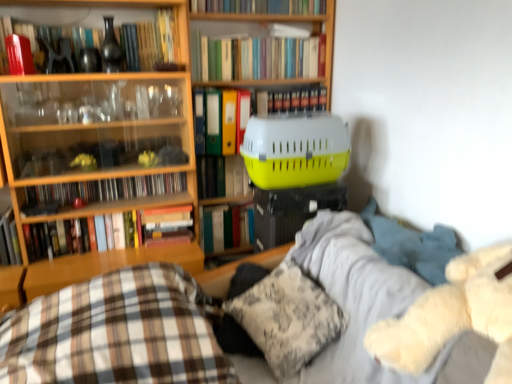
Measure the distance between fluffy white pillow at center, which is the 1th pillow from right to left, and camera.

fluffy white pillow at center, which is the 1th pillow from right to left, is 1.52 meters from camera.

What is the approximate width of fluffy white pillow at center, which is the 1th pillow from right to left?

fluffy white pillow at center, which is the 1th pillow from right to left, is 16.42 inches in width.

What is the approximate width of hardcover book at center, positioned as the tenth book in top-to-bottom order?

It is 5.63 inches.

I want to click on hardcover book at center, which is the second book from bottom to top, so (106, 233).

What do you see at coordinates (100, 191) in the screenshot? The width and height of the screenshot is (512, 384). I see `matte black book at left, placed as the eighth book when sorted from top to bottom` at bounding box center [100, 191].

Where is `matte black book at left, marked as the 4th book in a bottom-to-top arrangement`? Image resolution: width=512 pixels, height=384 pixels. matte black book at left, marked as the 4th book in a bottom-to-top arrangement is located at coordinates (100, 191).

Describe the element at coordinates (96, 151) in the screenshot. I see `wooden bookshelf at left` at that location.

Find the location of `fluffy white pillow at center, which is counted as the 2th pillow, starting from the left`. fluffy white pillow at center, which is counted as the 2th pillow, starting from the left is located at coordinates (278, 317).

Where is `book that is the 7th one when counting forward from the hardcover books at upper center, placed as the ninth book when sorted from bottom to top`? The width and height of the screenshot is (512, 384). book that is the 7th one when counting forward from the hardcover books at upper center, placed as the ninth book when sorted from bottom to top is located at coordinates pos(150,41).

Is hardcover books at upper center, placed as the ninth book when sorted from bottom to top, facing towards matte black vase at upper left, the fourth book positioned from the top?

No.

Is hardcover books at upper center, placed as the third book when sorted from top to bottom, next to matte black vase at upper left, which is counted as the eighth book, starting from the bottom, and touching it?

No, hardcover books at upper center, placed as the third book when sorted from top to bottom, is not touching matte black vase at upper left, which is counted as the eighth book, starting from the bottom.

From the image's perspective, which is below, hardcover books at upper center, placed as the third book when sorted from top to bottom, or matte black vase at upper left, the fourth book positioned from the top?

matte black vase at upper left, the fourth book positioned from the top, is shown below in the image.

Is hardcover book at center, which appears as the 5th book when ordered from the bottom, thinner than yellow matte file folder at center, which appears as the 6th book when ordered from the bottom?

Yes, hardcover book at center, which appears as the 5th book when ordered from the bottom, is thinner than yellow matte file folder at center, which appears as the 6th book when ordered from the bottom.

Is hardcover book at center, the seventh book positioned from the top, positioned before yellow matte file folder at center, which appears as the 6th book when ordered from the bottom?

No, it is not.

Based on their sizes in the image, would you say hardcover book at center, which appears as the 5th book when ordered from the bottom, is bigger or smaller than yellow matte file folder at center, which appears as the 6th book when ordered from the bottom?

In the image, hardcover book at center, which appears as the 5th book when ordered from the bottom, appears to be smaller than yellow matte file folder at center, which appears as the 6th book when ordered from the bottom.

From a real-world perspective, does hardcover book at center, which appears as the 5th book when ordered from the bottom, sit lower than yellow matte file folder at center, which appears as the 6th book when ordered from the bottom?

Yes, from a real-world perspective, hardcover book at center, which appears as the 5th book when ordered from the bottom, is below yellow matte file folder at center, which appears as the 6th book when ordered from the bottom.

Find the location of a particular element. the 5th book below the wooden bookcase at center (from the image's perspective) is located at coordinates (9, 240).

From the image's perspective, is wooden bookcase at center on top of hardcover book at left, which ranks as the 11th book in top-to-bottom order?

Yes.

Is wooden bookcase at center at the right side of hardcover book at left, which ranks as the 1th book in bottom-to-top order?

Indeed, wooden bookcase at center is positioned on the right side of hardcover book at left, which ranks as the 1th book in bottom-to-top order.

Is wooden bookshelf at left wider or thinner than yellow matte file folder at center, which appears as the 6th book when ordered from the bottom?

In the image, wooden bookshelf at left appears to be wider than yellow matte file folder at center, which appears as the 6th book when ordered from the bottom.

In the scene shown: From a real-world perspective, between wooden bookshelf at left and yellow matte file folder at center, the 6th book in the top-to-bottom sequence, who is vertically higher?

From a 3D spatial view, yellow matte file folder at center, the 6th book in the top-to-bottom sequence, is above.

Considering the relative sizes of wooden bookshelf at left and yellow matte file folder at center, which appears as the 6th book when ordered from the bottom, in the image provided, is wooden bookshelf at left bigger than yellow matte file folder at center, which appears as the 6th book when ordered from the bottom,?

Correct, wooden bookshelf at left is larger in size than yellow matte file folder at center, which appears as the 6th book when ordered from the bottom.

Consider the image. Is yellow plastic pet carrier at upper right surrounding wooden bookcase at center?

No, wooden bookcase at center is not a part of yellow plastic pet carrier at upper right.

Can you confirm if yellow plastic pet carrier at upper right is thinner than wooden bookcase at center?

No, yellow plastic pet carrier at upper right is not thinner than wooden bookcase at center.

Considering the positions of point (254, 169) and point (260, 168), is point (254, 169) closer or farther from the camera than point (260, 168)?

Point (254, 169) is positioned farther from the camera compared to point (260, 168).

Is yellow plastic pet carrier at upper right further to the viewer compared to wooden bookcase at center?

No, the depth of yellow plastic pet carrier at upper right is less than that of wooden bookcase at center.

Does wooden bookshelf at left have a greater width compared to hardcover book at center, the seventh book positioned from the top?

Yes, wooden bookshelf at left is wider than hardcover book at center, the seventh book positioned from the top.

Where is `the 5th book to the right when counting from the wooden bookshelf at left`? This screenshot has height=384, width=512. the 5th book to the right when counting from the wooden bookshelf at left is located at coordinates click(222, 177).

Which point is more distant from viewer, (x=45, y=209) or (x=239, y=161)?

The point (x=239, y=161) is farther from the camera.

Is hardcover book at center, which appears as the 5th book when ordered from the bottom, at the back of wooden bookshelf at left?

wooden bookshelf at left is not turned away from hardcover book at center, which appears as the 5th book when ordered from the bottom.

Based on the photo, from the image's perspective, is wooden bookcase at center located beneath white fluffy teddy bear at right?

No, from the image's perspective, wooden bookcase at center is not beneath white fluffy teddy bear at right.

Is wooden bookcase at center not inside white fluffy teddy bear at right?

wooden bookcase at center is positioned outside white fluffy teddy bear at right.

Does wooden bookcase at center lie behind white fluffy teddy bear at right?

That is True.

The height and width of the screenshot is (384, 512). Identify the location of teddy in front of the wooden bookcase at center. (452, 315).

Which book is the 8th one when counting from the left side of the hardcover books at upper center, placed as the third book when sorted from top to bottom? Please provide its 2D coordinates.

[(150, 41)]

I want to click on book that is the 1st one above the hardcover book at center, the seventh book positioned from the top (from a real-world perspective), so click(223, 119).

Looking at the image, which one is located closer to matte black vase at upper left, which is counted as the eighth book, starting from the bottom, matte black book at left, placed as the eighth book when sorted from top to bottom, or wooden bookshelf at left?

Based on the image, wooden bookshelf at left appears to be nearer to matte black vase at upper left, which is counted as the eighth book, starting from the bottom.

Consider the image. Which object lies further to the anchor point fluffy white pillow at lower center, which is counted as the 2th pillow, starting from the right, green matte book at center, positioned as the third book in bottom-to-top order, or fluffy white pillow at center, which is counted as the 2th pillow, starting from the left?

green matte book at center, positioned as the third book in bottom-to-top order, lies further to fluffy white pillow at lower center, which is counted as the 2th pillow, starting from the right, than the other object.

Which object lies nearer to the anchor point hardcover book at center, the seventh book positioned from the top, green matte book at center, positioned as the third book in bottom-to-top order, or hardcover book at center, which is the second book from bottom to top?

green matte book at center, positioned as the third book in bottom-to-top order, is closer to hardcover book at center, the seventh book positioned from the top.

Estimate the real-world distances between objects in this image. Which object is further from wooden bookshelf at left, hardcover book at upper center, the 10th book when ordered from bottom to top, or hardcover book at center, the seventh book positioned from the top?

hardcover book at upper center, the 10th book when ordered from bottom to top, is further to wooden bookshelf at left.

Based on their spatial positions, is hardcover book at center, which appears as the 5th book when ordered from the bottom, or yellow plastic pet carrier at upper right closer to hardcover book at upper center, the 11th book ordered from the bottom?

yellow plastic pet carrier at upper right is positioned closer to the anchor hardcover book at upper center, the 11th book ordered from the bottom.

Looking at the image, which one is located further to hardcover book at center, the seventh book positioned from the top, hardcover book at center, arranged as the seventh book when ordered from the bottom, or wooden bookshelf at left?

wooden bookshelf at left lies further to hardcover book at center, the seventh book positioned from the top, than the other object.

Considering their positions, is matte black book at left, placed as the eighth book when sorted from top to bottom, positioned further to yellow matte file folder at center, the 6th book in the top-to-bottom sequence, than hardcover books at upper center, placed as the ninth book when sorted from bottom to top?

matte black book at left, placed as the eighth book when sorted from top to bottom, is positioned further to the anchor yellow matte file folder at center, the 6th book in the top-to-bottom sequence.

From the image, which object appears to be farther from green matte book at center, positioned as the ninth book in top-to-bottom order, yellow plastic pet carrier at upper right or white fluffy teddy bear at right?

white fluffy teddy bear at right.

The height and width of the screenshot is (384, 512). What are the coordinates of `teddy between fluffy white pillow at lower center, which is counted as the 2th pillow, starting from the right, and matte black book at left, placed as the eighth book when sorted from top to bottom, from front to back` in the screenshot? It's located at (452, 315).

At what (x,y) coordinates should I click in order to perform the action: click on bookcase between hardcover book at upper center, the 11th book ordered from the bottom, and matte black book at left, marked as the 4th book in a bottom-to-top arrangement, in the up-down direction. Please return your answer as a coordinate pair (x, y). Looking at the image, I should click on (284, 83).

Where is `cabinet between fluffy white pillow at lower center, which is counted as the 2th pillow, starting from the right, and hardcover book at left, which ranks as the 1th book in bottom-to-top order, from front to back`? The width and height of the screenshot is (512, 384). cabinet between fluffy white pillow at lower center, which is counted as the 2th pillow, starting from the right, and hardcover book at left, which ranks as the 1th book in bottom-to-top order, from front to back is located at coordinates (96, 151).

Where is `basket between fluffy white pillow at lower center, the first pillow from the left, and hardcover book at center, arranged as the seventh book when ordered from the bottom, from front to back`? This screenshot has height=384, width=512. basket between fluffy white pillow at lower center, the first pillow from the left, and hardcover book at center, arranged as the seventh book when ordered from the bottom, from front to back is located at coordinates (295, 149).